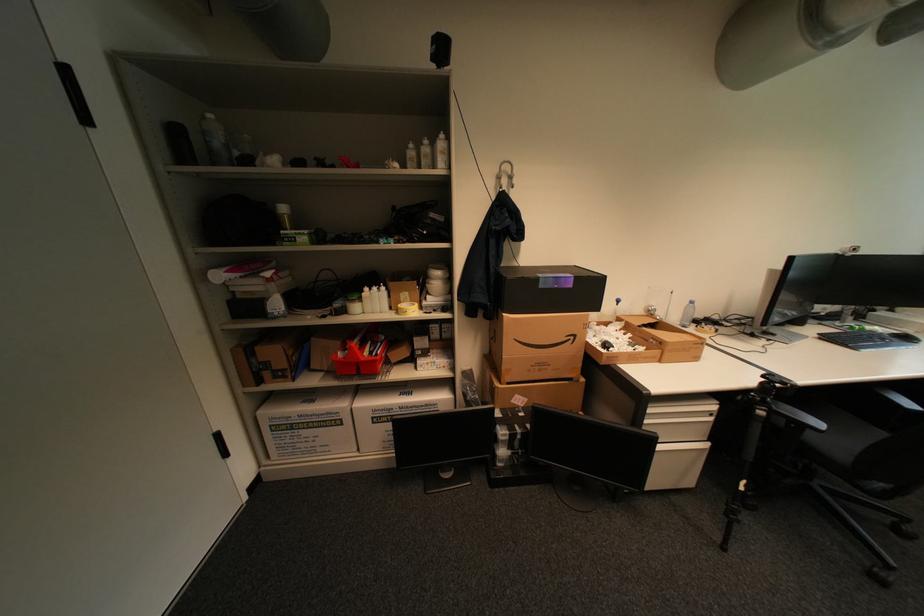
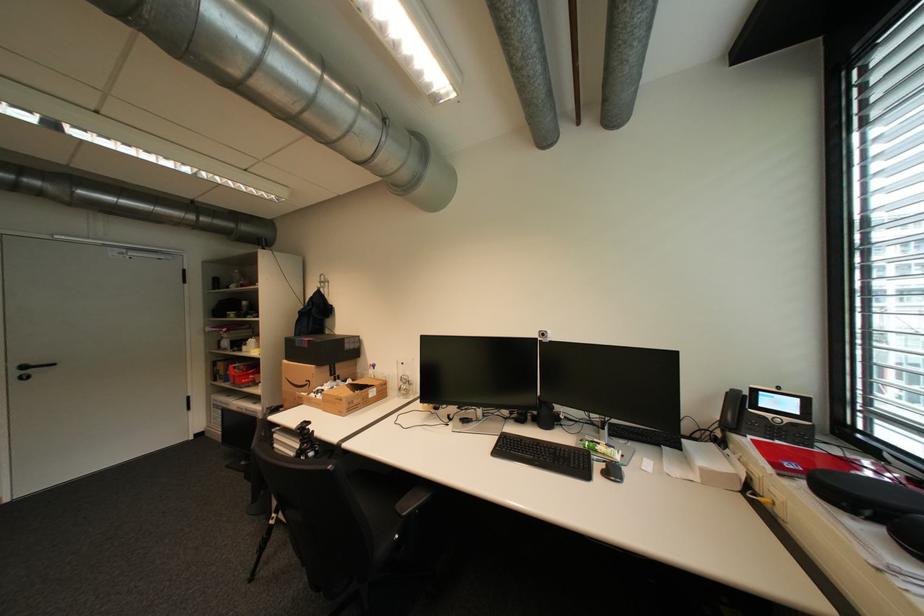
Locate, in the second image, the point that corresponds to point 565,286 in the first image.

(310, 346)